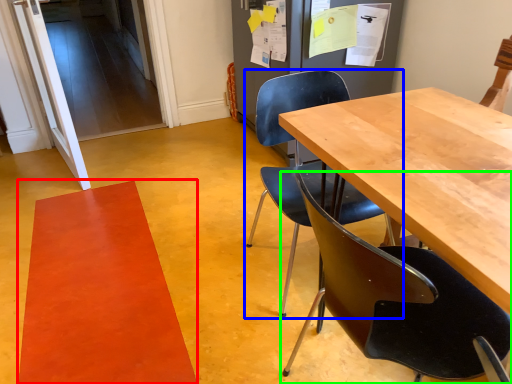
Question: Estimate the real-world distances between objects in this image. Which object is closer to mat (highlighted by a red box), chair (highlighted by a blue box) or chair (highlighted by a green box)?

Choices:
 (A) chair
 (B) chair

Answer: (A)